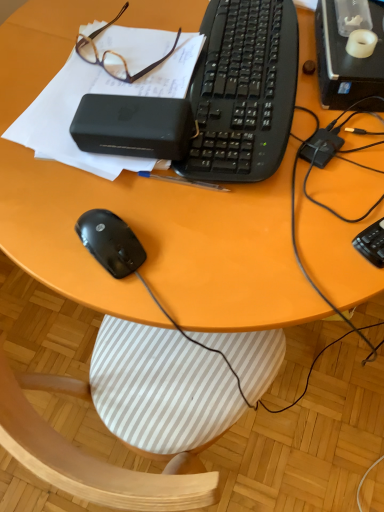
Question: Can you confirm if brown plastic glasses at upper left is shorter than black plastic keyboard at right, the 1th computer keyboard viewed from the front?

Choices:
 (A) no
 (B) yes

Answer: (A)

Question: Can you confirm if brown plastic glasses at upper left is smaller than black plastic keyboard at right, placed as the second computer keyboard when sorted from back to front?

Choices:
 (A) yes
 (B) no

Answer: (B)

Question: Is brown plastic glasses at upper left to the left of black plastic keyboard at right, the first computer keyboard positioned from the bottom, from the viewer's perspective?

Choices:
 (A) no
 (B) yes

Answer: (B)

Question: Can you confirm if brown plastic glasses at upper left is taller than black plastic keyboard at right, the first computer keyboard positioned from the bottom?

Choices:
 (A) yes
 (B) no

Answer: (A)

Question: Is brown plastic glasses at upper left wider than black plastic keyboard at right, the 1th computer keyboard viewed from the front?

Choices:
 (A) no
 (B) yes

Answer: (A)

Question: From a real-world perspective, is brown plastic glasses at upper left located beneath black plastic keyboard at right, which ranks as the second computer keyboard in top-to-bottom order?

Choices:
 (A) yes
 (B) no

Answer: (B)

Question: Considering the relative positions of black plastic power bank at upper center and black matte notepad at upper left in the image provided, is black plastic power bank at upper center in front of black matte notepad at upper left?

Choices:
 (A) yes
 (B) no

Answer: (A)

Question: Is black plastic power bank at upper center not within black matte notepad at upper left?

Choices:
 (A) yes
 (B) no

Answer: (B)

Question: Is black plastic power bank at upper center thinner than black matte notepad at upper left?

Choices:
 (A) yes
 (B) no

Answer: (A)

Question: Does black plastic power bank at upper center appear on the left side of black matte notepad at upper left?

Choices:
 (A) no
 (B) yes

Answer: (A)

Question: Is black plastic power bank at upper center to the right of black matte notepad at upper left from the viewer's perspective?

Choices:
 (A) no
 (B) yes

Answer: (B)

Question: Can you confirm if black plastic power bank at upper center is shorter than black matte notepad at upper left?

Choices:
 (A) yes
 (B) no

Answer: (B)

Question: Can you see brown plastic glasses at upper left touching black plastic desktop computer at upper right?

Choices:
 (A) yes
 (B) no

Answer: (B)